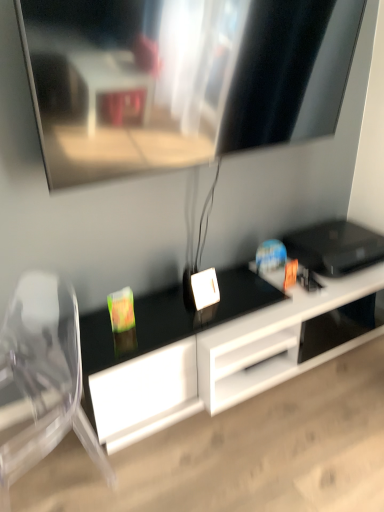
Find the location of a particular element. The image size is (384, 512). free space below transparent plastic swivel chair at left (from a real-world perspective) is located at coordinates (40, 472).